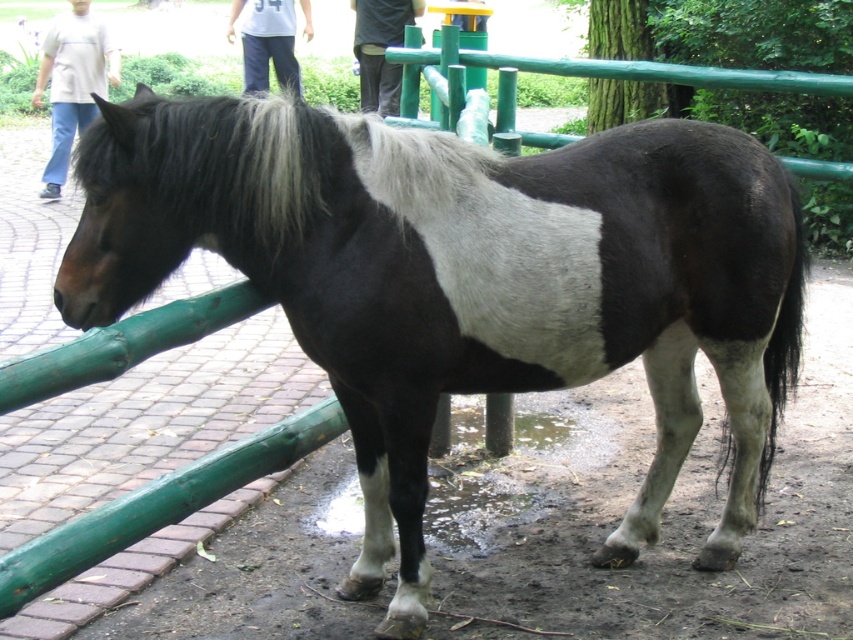
Question: Can you confirm if white cotton pants at upper center is smaller than black pants at center?

Choices:
 (A) no
 (B) yes

Answer: (A)

Question: Estimate the real-world distances between objects in this image. Which object is farther from the black pants at center?

Choices:
 (A) white cotton shirt at upper left
 (B) white cotton pants at upper center
 (C) black silky mane at upper left

Answer: (C)

Question: Is black silky mane at upper left smaller than black pants at center?

Choices:
 (A) yes
 (B) no

Answer: (A)

Question: Which of these objects is positioned closest to the black silky mane at upper left?

Choices:
 (A) white cotton shirt at upper left
 (B) white cotton pants at upper center

Answer: (B)

Question: Can you confirm if white cotton pants at upper center is smaller than black pants at center?

Choices:
 (A) yes
 (B) no

Answer: (B)

Question: Which object is the farthest from the white cotton pants at upper center?

Choices:
 (A) white cotton shirt at upper left
 (B) black silky mane at upper left
 (C) black pants at center

Answer: (B)